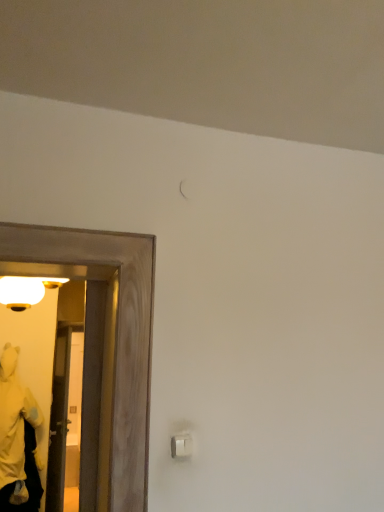
Question: Does white plastic light switch at lower right appear on the right side of wooden door at left?

Choices:
 (A) yes
 (B) no

Answer: (A)

Question: Does white plastic light switch at lower right come in front of wooden door at left?

Choices:
 (A) yes
 (B) no

Answer: (A)

Question: Considering the relative sizes of white plastic light switch at lower right and wooden door at left in the image provided, is white plastic light switch at lower right wider than wooden door at left?

Choices:
 (A) no
 (B) yes

Answer: (A)

Question: Is white plastic light switch at lower right at the left side of wooden door at left?

Choices:
 (A) no
 (B) yes

Answer: (A)

Question: Is white plastic light switch at lower right oriented towards wooden door at left?

Choices:
 (A) no
 (B) yes

Answer: (A)

Question: Considering the positions of yellow plush at left and white plastic light switch at lower right in the image, is yellow plush at left wider or thinner than white plastic light switch at lower right?

Choices:
 (A) thin
 (B) wide

Answer: (B)

Question: Is yellow plush at left inside the boundaries of white plastic light switch at lower right, or outside?

Choices:
 (A) inside
 (B) outside

Answer: (B)

Question: Is point (21, 419) closer or farther from the camera than point (182, 444)?

Choices:
 (A) farther
 (B) closer

Answer: (A)

Question: From a real-world perspective, is yellow plush at left above or below white plastic light switch at lower right?

Choices:
 (A) above
 (B) below

Answer: (B)

Question: Is transparent glass door at left taller or shorter than matte white globe at left?

Choices:
 (A) tall
 (B) short

Answer: (A)

Question: From the image's perspective, relative to matte white globe at left, is transparent glass door at left above or below?

Choices:
 (A) below
 (B) above

Answer: (A)

Question: Is point (99, 474) positioned closer to the camera than point (11, 286)?

Choices:
 (A) farther
 (B) closer

Answer: (B)

Question: From a real-world perspective, is transparent glass door at left positioned above or below matte white globe at left?

Choices:
 (A) above
 (B) below

Answer: (B)

Question: From a real-world perspective, relative to white plastic light switch at lower right, is wooden door at left vertically above or below?

Choices:
 (A) below
 (B) above

Answer: (A)

Question: Is wooden door at left in front of or behind white plastic light switch at lower right in the image?

Choices:
 (A) front
 (B) behind

Answer: (B)